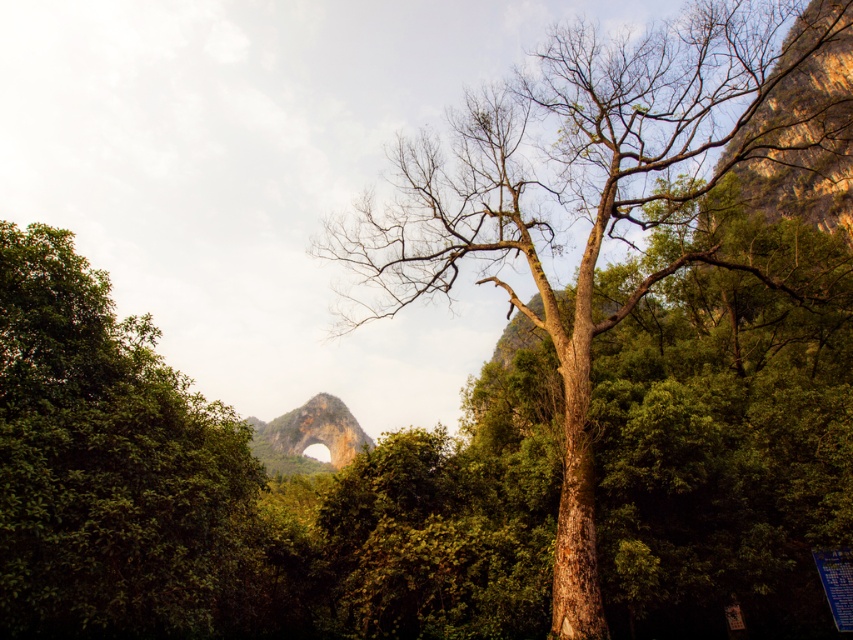
Question: Which point is closer to the camera?

Choices:
 (A) green leafy tree at left
 (B) rustic stone arch at center
 (C) brown rough bark tree at center

Answer: (A)

Question: Is brown rough bark tree at center above green leafy tree at left?

Choices:
 (A) yes
 (B) no

Answer: (A)

Question: Is brown rough bark tree at center thinner than green leafy tree at left?

Choices:
 (A) no
 (B) yes

Answer: (A)

Question: Is brown rough bark tree at center positioned in front of rustic stone arch at center?

Choices:
 (A) no
 (B) yes

Answer: (B)

Question: Which object appears closest to the camera in this image?

Choices:
 (A) green leafy tree at left
 (B) rustic stone arch at center
 (C) brown rough bark tree at center

Answer: (A)

Question: Which is farther from the green leafy tree at left?

Choices:
 (A) rustic stone arch at center
 (B) brown rough bark tree at center

Answer: (A)